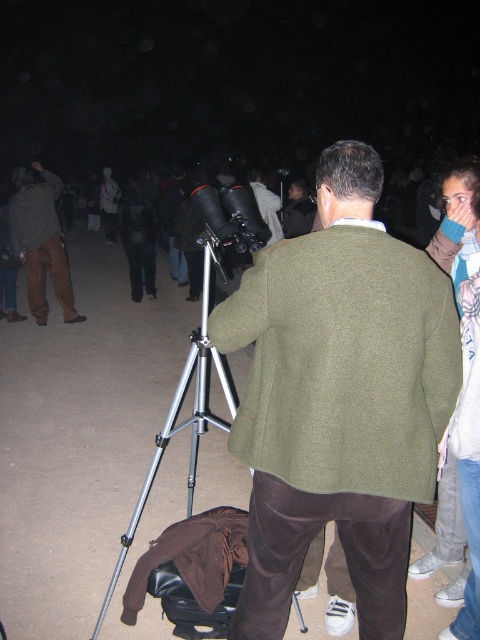
Find the location of a particular element. The height and width of the screenshot is (640, 480). green woolen sweater at center is located at coordinates (344, 362).

Is green woolen sweater at center shorter than brown cotton pants at left?

Yes, green woolen sweater at center is shorter than brown cotton pants at left.

Does point (421, 337) come in front of point (28, 240)?

Yes.

What are the coordinates of `green woolen sweater at center` in the screenshot? It's located at (344, 362).

Between green woolen sweater at center and dark green wool sweater at upper left, which one appears on the left side from the viewer's perspective?

Positioned to the left is dark green wool sweater at upper left.

Is point (368, 259) more distant than point (37, 221)?

No.

Who is more forward, [420,436] or [56,186]?

Point [420,436]

Where is `green woolen sweater at center`? The height and width of the screenshot is (640, 480). green woolen sweater at center is located at coordinates (344, 362).

Who is positioned more to the left, silver metallic tripod at center or brown cotton pants at left?

brown cotton pants at left is more to the left.

Is silver metallic tripod at center closer to camera compared to brown cotton pants at left?

That is True.

Between point (211, 240) and point (66, 289), which one is positioned behind?

Positioned behind is point (66, 289).

Locate an element on the screen. This screenshot has height=640, width=480. silver metallic tripod at center is located at coordinates [186, 419].